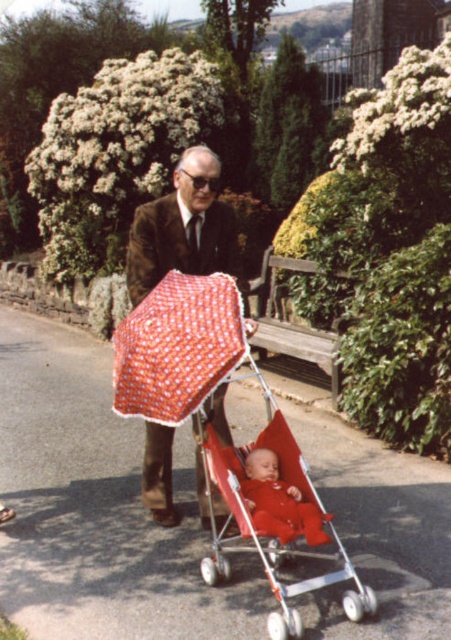
Question: Which object is closer to the camera taking this photo?

Choices:
 (A) matte red baby at center
 (B) brown woolen suit at center
 (C) red polka dot fabric umbrella at center
 (D) red fabric stroller at center

Answer: (D)

Question: Which object is positioned closest to the red polka dot fabric umbrella at center?

Choices:
 (A) brown woolen suit at center
 (B) matte red baby at center

Answer: (A)

Question: Is red polka dot fabric umbrella at center above brown woolen suit at center?

Choices:
 (A) yes
 (B) no

Answer: (B)

Question: Does red polka dot fabric umbrella at center appear under red fabric stroller at center?

Choices:
 (A) no
 (B) yes

Answer: (A)

Question: Which of the following is the farthest from the observer?

Choices:
 (A) (239, 292)
 (B) (225, 428)
 (C) (254, 513)

Answer: (B)

Question: Is the position of brown woolen suit at center less distant than that of matte red baby at center?

Choices:
 (A) no
 (B) yes

Answer: (A)